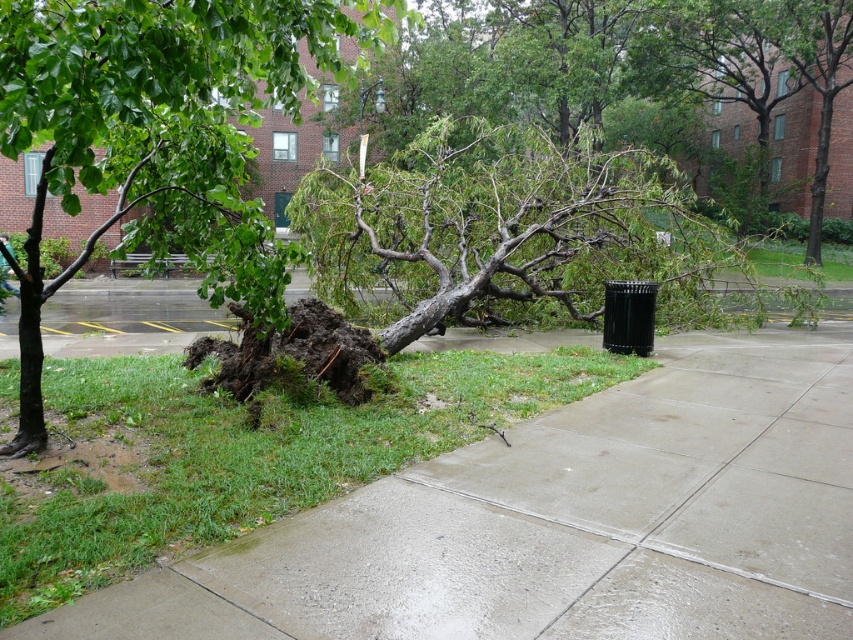
Question: Among these points, which one is nearest to the camera?

Choices:
 (A) (366, 51)
 (B) (305, 573)

Answer: (B)

Question: Can you confirm if concrete at center is smaller than green leafy tree at left?

Choices:
 (A) yes
 (B) no

Answer: (A)

Question: Can you confirm if concrete at center is wider than green leafy tree at left?

Choices:
 (A) no
 (B) yes

Answer: (A)

Question: Is concrete at center wider than green leafy tree at left?

Choices:
 (A) yes
 (B) no

Answer: (B)